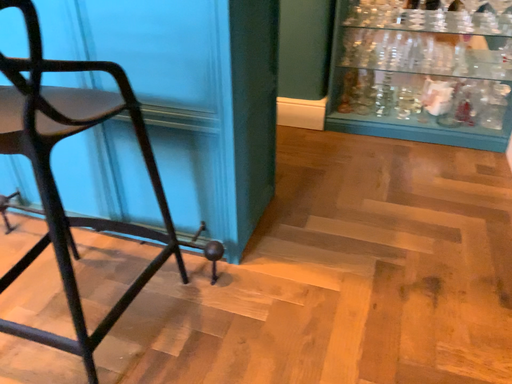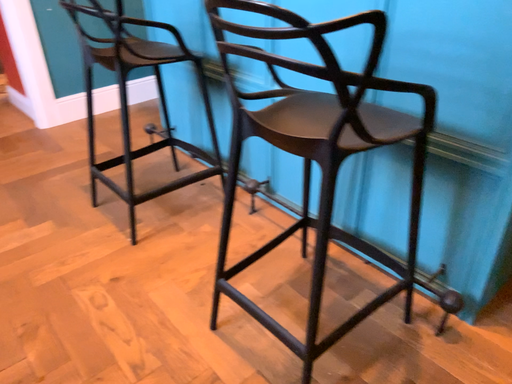
Question: Which way did the camera rotate in the video?

Choices:
 (A) rotated left
 (B) rotated right

Answer: (A)